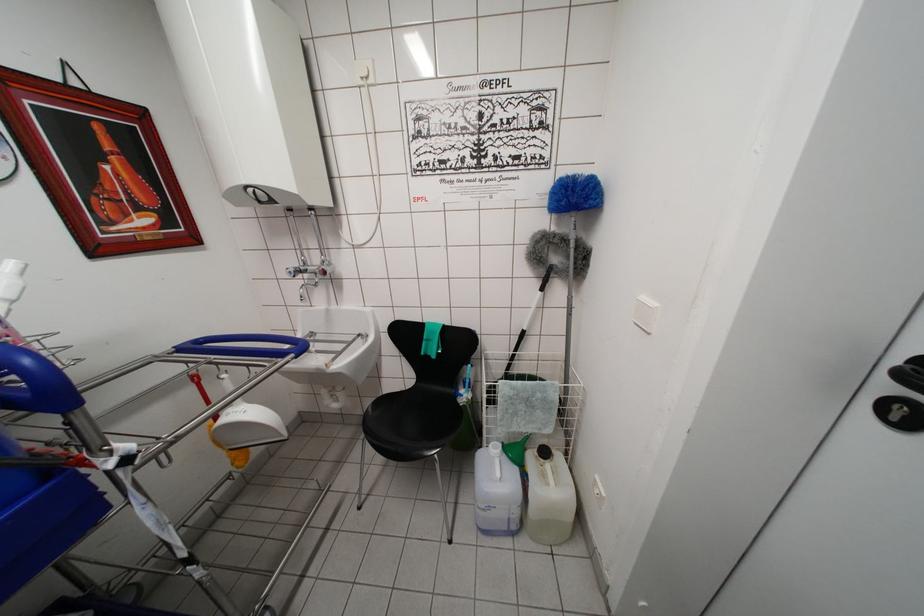
The height and width of the screenshot is (616, 924). I want to click on blue cart handle, so click(35, 383).